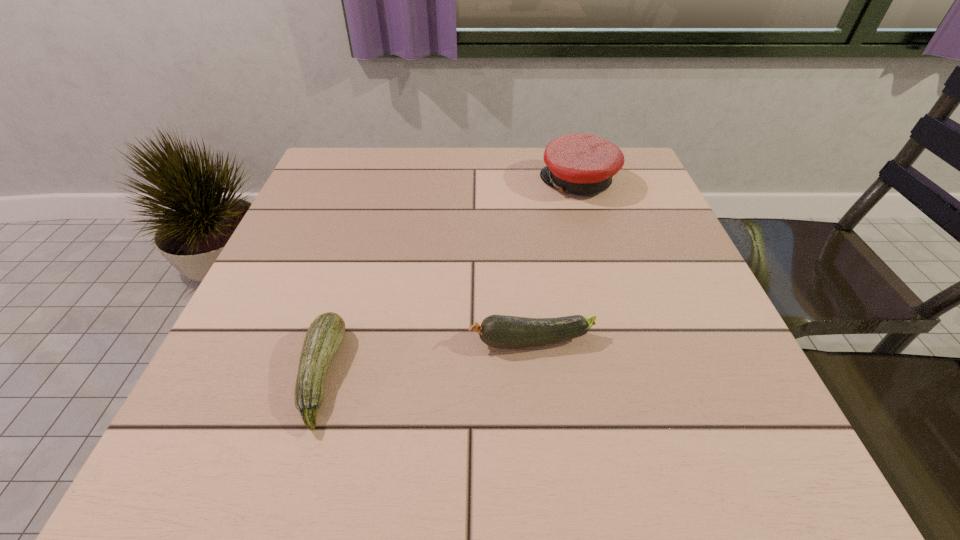
I want to click on free space at the right edge of the desktop, so click(x=650, y=316).

Locate an element on the screen. vacant point at the far left corner is located at coordinates (325, 186).

Image resolution: width=960 pixels, height=540 pixels. I want to click on free spot between the tallest object and the left zucchini, so click(x=449, y=279).

Find the location of a particular element. This screenshot has height=540, width=960. empty space between the farthest object and the right zucchini is located at coordinates (555, 262).

The image size is (960, 540). Identify the location of free space between the leftmost object and the tallest object. (449, 279).

You are a GUI agent. You are given a task and a screenshot of the screen. Output one action in this format:
    pyautogui.click(x=<x>, y=<y>)
    Task: Click on the free space between the cap and the leftmost object
    
    Given the screenshot: What is the action you would take?
    pyautogui.click(x=449, y=279)

Where is `free space between the right zucchini and the left zucchini`? This screenshot has width=960, height=540. free space between the right zucchini and the left zucchini is located at coordinates (426, 359).

Locate an element on the screen. This screenshot has height=540, width=960. free spot between the cap and the left zucchini is located at coordinates 449,279.

The width and height of the screenshot is (960, 540). What are the coordinates of `free space between the left zucchini and the tallest object` in the screenshot? It's located at (449, 279).

The height and width of the screenshot is (540, 960). Find the location of `empty space that is in between the right zucchini and the left zucchini`. empty space that is in between the right zucchini and the left zucchini is located at coordinates (426, 359).